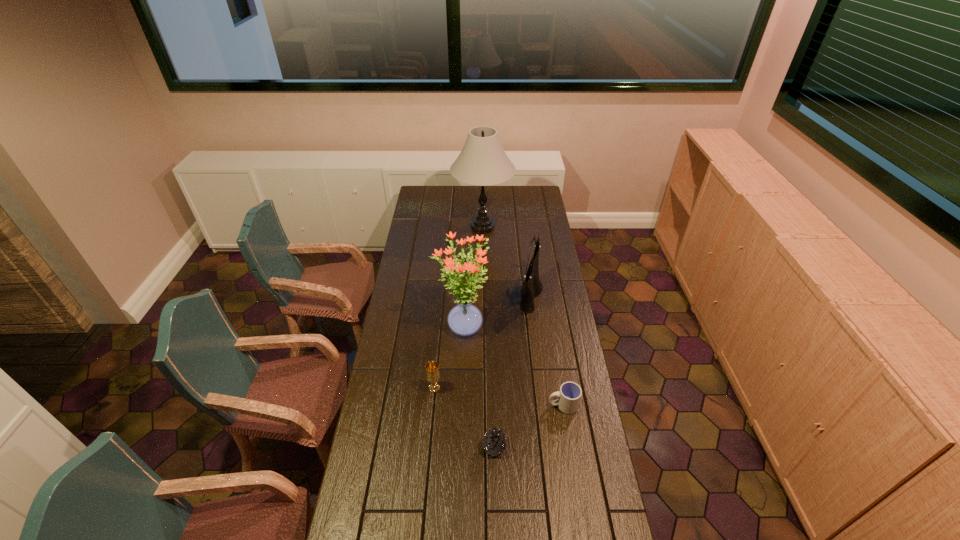
Image resolution: width=960 pixels, height=540 pixels. What are the coordinates of `vacant space located 0.170m on the left of the fourth shortest object` in the screenshot? It's located at (485, 294).

You are a GUI agent. You are given a task and a screenshot of the screen. Output one action in this format:
    pyautogui.click(x=<x>, y=<y>)
    Task: Click on the vacant region located on the back of the chalice
    
    Given the screenshot: What is the action you would take?
    pyautogui.click(x=438, y=355)

What are the coordinates of `vacant position located on the front of the nearest object` in the screenshot? It's located at (496, 516).

Find the location of a particular element. The image size is (960, 540). free space located with the handle on the side of the cup is located at coordinates (519, 405).

Image resolution: width=960 pixels, height=540 pixels. Find the location of `free space located 0.200m with the handle on the side of the cup`. free space located 0.200m with the handle on the side of the cup is located at coordinates (496, 405).

Where is `vacant space situated 0.060m with the handle on the side of the cup`? Image resolution: width=960 pixels, height=540 pixels. vacant space situated 0.060m with the handle on the side of the cup is located at coordinates (533, 405).

I want to click on shoulder bag present at the right edge, so click(530, 289).

The width and height of the screenshot is (960, 540). Identify the location of cup situated at the right edge. (569, 396).

The height and width of the screenshot is (540, 960). What are the coordinates of `free region at the far edge of the desktop` in the screenshot? It's located at (514, 188).

Locate an element on the screen. vacant space at the left edge of the desktop is located at coordinates (395, 290).